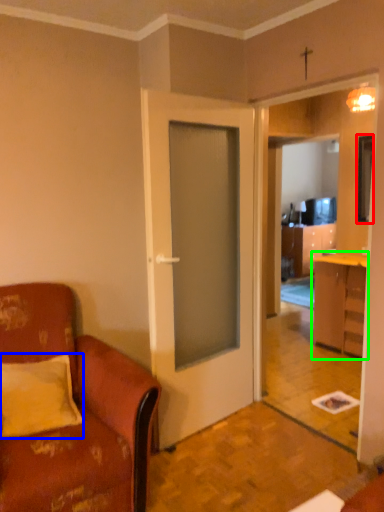
Question: Which is farther away from television (highlighted by a red box)? pillow (highlighted by a blue box) or cabinetry (highlighted by a green box)?

Choices:
 (A) pillow
 (B) cabinetry

Answer: (A)